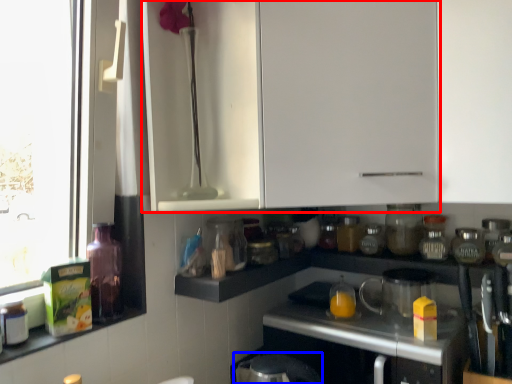
Question: Which object is further to the camera taking this photo, cabinetry (highlighted by a red box) or appliance (highlighted by a blue box)?

Choices:
 (A) cabinetry
 (B) appliance

Answer: (A)